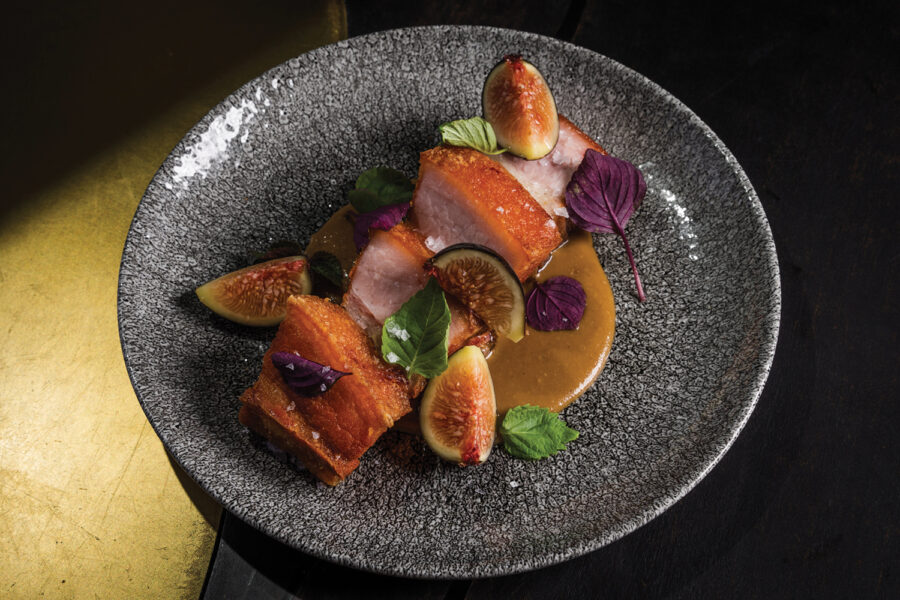
Locate an element on the screen. This screenshot has width=900, height=600. table is located at coordinates (140, 504), (828, 481).